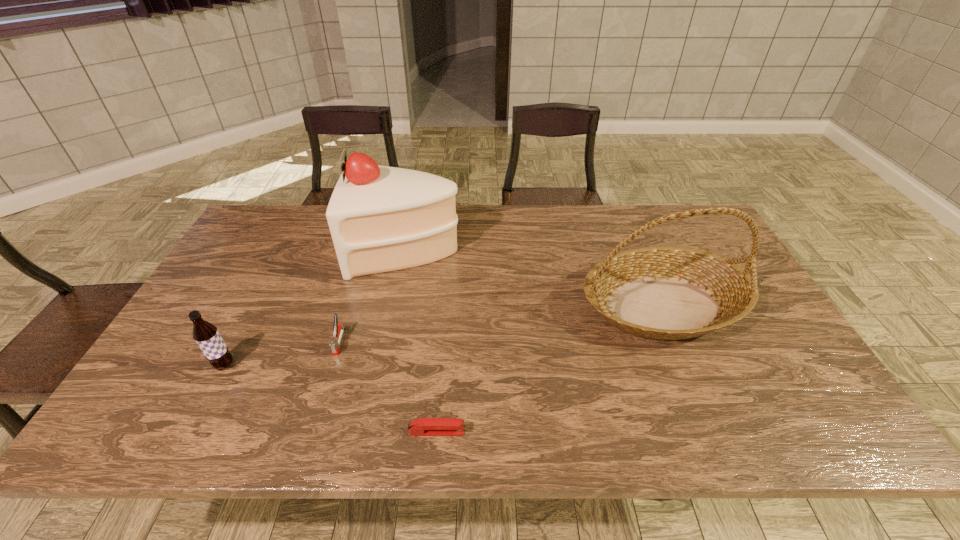
Image resolution: width=960 pixels, height=540 pixels. In the image, there is a desktop. Identify the location of vacant space at the far left corner. (252, 220).

Find the location of a particular element. This screenshot has height=540, width=960. vacant space at the near left corner of the desktop is located at coordinates (158, 434).

What are the coordinates of `vacant space at the far right corner` in the screenshot? It's located at (694, 228).

Image resolution: width=960 pixels, height=540 pixels. In the image, there is a desktop. Identify the location of vacant space at the near right corner. pos(781,437).

You are a GUI agent. You are given a task and a screenshot of the screen. Output one action in this format:
    pyautogui.click(x=<x>, y=<y>)
    Task: Click on the free space between the cake and the rightmost object
    The height and width of the screenshot is (540, 960).
    Given the screenshot: What is the action you would take?
    pyautogui.click(x=535, y=278)

This screenshot has height=540, width=960. Find the location of `free space between the left stapler and the shortest object`. free space between the left stapler and the shortest object is located at coordinates (388, 387).

You are a GUI agent. You are given a task and a screenshot of the screen. Output one action in this format:
    pyautogui.click(x=<x>, y=<y>)
    Task: Click on the empty location between the shortest object and the root beer
    
    Given the screenshot: What is the action you would take?
    pyautogui.click(x=330, y=399)

You are a GUI agent. You are given a task and a screenshot of the screen. Output one action in this format:
    pyautogui.click(x=<x>, y=<y>)
    Task: Click on the vacant space that is in between the rightmost object and the farther stapler
    The image size is (960, 540).
    Given the screenshot: What is the action you would take?
    pyautogui.click(x=501, y=323)

Identify the location of vacant area that lies between the farther stapler and the root beer. This screenshot has height=540, width=960. (282, 353).

This screenshot has width=960, height=540. I want to click on unoccupied area between the second shortest object and the fourth farthest object, so tap(282, 353).